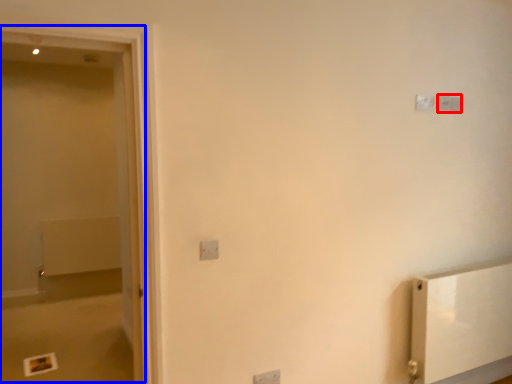
Question: Which object appears farthest to the camera in this image, light switch (highlighted by a red box) or screen door (highlighted by a blue box)?

Choices:
 (A) light switch
 (B) screen door

Answer: (A)